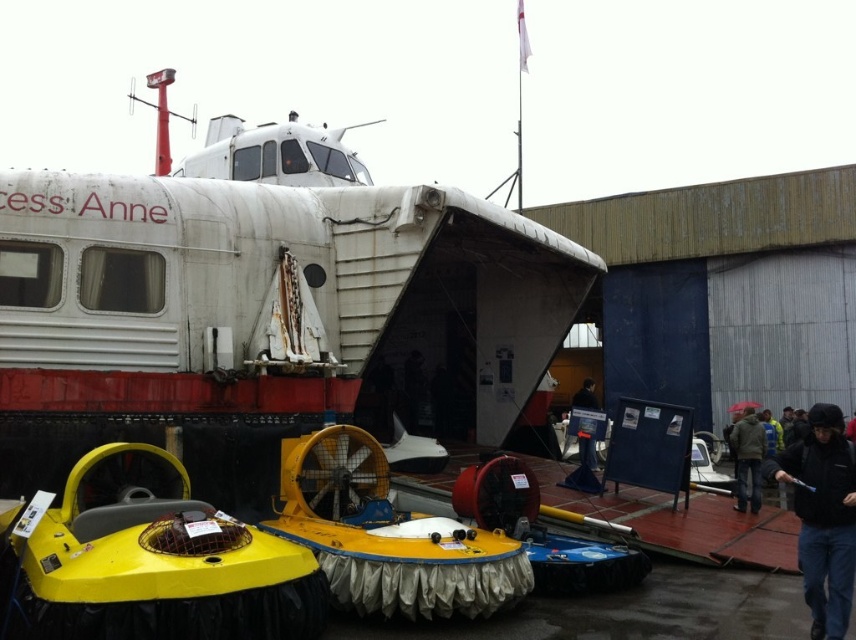
Is brown fuzzy jacket at lower right wider than black jacket at lower right?

In fact, brown fuzzy jacket at lower right might be narrower than black jacket at lower right.

Locate an element on the screen. brown fuzzy jacket at lower right is located at coordinates tap(747, 460).

Between point (266, 193) and point (741, 445), which one is positioned behind?

The point (741, 445) is behind.

Who is higher up, white matte boat at center or brown fuzzy jacket at lower right?

white matte boat at center is above.

What do you see at coordinates (266, 310) in the screenshot?
I see `white matte boat at center` at bounding box center [266, 310].

Locate an element on the screen. This screenshot has width=856, height=640. white matte boat at center is located at coordinates (266, 310).

From the picture: Which of these two, black matte jacket at lower right or brown fuzzy jacket at lower right, stands shorter?

Standing shorter between the two is black matte jacket at lower right.

Is point (831, 472) farther from viewer compared to point (742, 460)?

No.

Who is more forward, (813, 522) or (762, 456)?

Point (813, 522) is more forward.

This screenshot has width=856, height=640. Identify the location of black matte jacket at lower right. (823, 516).